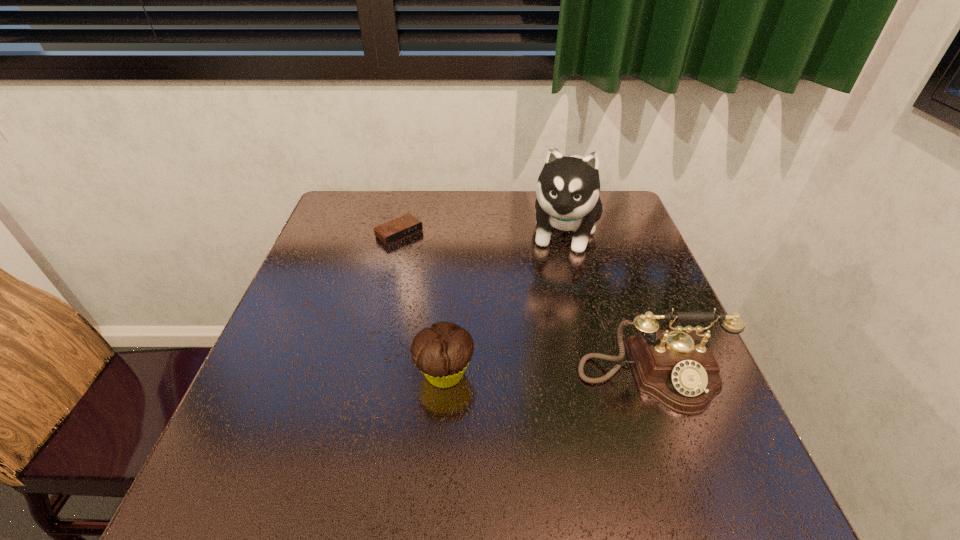
Where is `empty space between the leftmost object and the telephone`? empty space between the leftmost object and the telephone is located at coordinates (525, 305).

Locate an element on the screen. free space between the alarm clock and the third object from right to left is located at coordinates (422, 303).

Where is `free space between the leftmost object and the telephone`? Image resolution: width=960 pixels, height=540 pixels. free space between the leftmost object and the telephone is located at coordinates (525, 305).

At what (x,y) coordinates should I click in order to perform the action: click on vacant space that's between the third shortest object and the tallest object. Please return your answer as a coordinate pair (x, y). Looking at the image, I should click on (608, 303).

The width and height of the screenshot is (960, 540). Identify the location of free space that is in between the third object from right to left and the leftmost object. (422, 303).

Find the location of a particular element. Image resolution: width=960 pixels, height=540 pixels. vacant space in between the puppy and the muffin is located at coordinates (504, 302).

Image resolution: width=960 pixels, height=540 pixels. I want to click on vacant area that lies between the shortest object and the third tallest object, so [422, 303].

Locate an element on the screen. The height and width of the screenshot is (540, 960). free space that is in between the tallest object and the alarm clock is located at coordinates (482, 232).

At what (x,y) coordinates should I click in order to perform the action: click on vacant area between the tallest object and the alarm clock. Please return your answer as a coordinate pair (x, y). The image size is (960, 540). Looking at the image, I should click on (482, 232).

You are a GUI agent. You are given a task and a screenshot of the screen. Output one action in this format:
    pyautogui.click(x=<x>, y=<y>)
    Task: Click on the free space that is in between the leftmost object and the puppy
    The width and height of the screenshot is (960, 540).
    Given the screenshot: What is the action you would take?
    pyautogui.click(x=482, y=232)